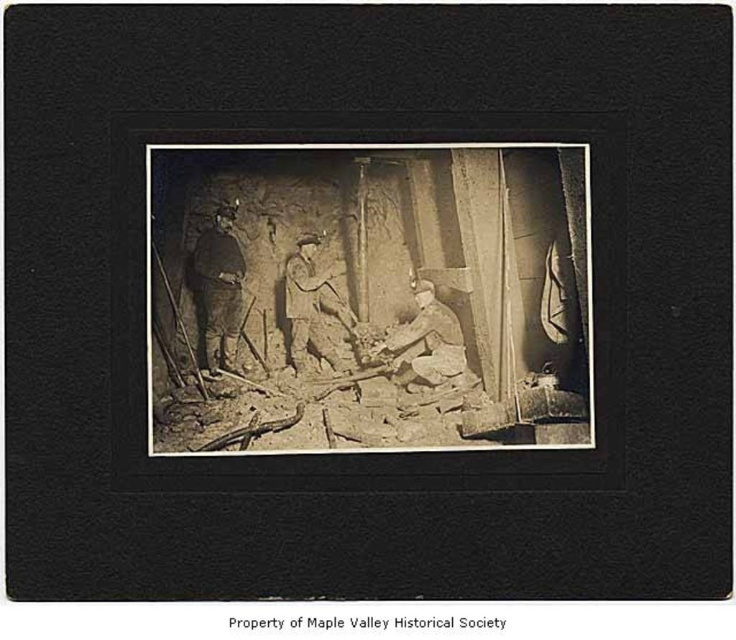
You are a safety inspector in this mining site. You need to ensure that the dark brown leather jacket at center and the light brown leather jacket at lower right can both fit on a storage shelf that is 1.2 meters wide. Based on their widths, will they fit together?

The dark brown leather jacket at center has a lesser width compared to light brown leather jacket at lower right. However, without knowing the exact widths of both jackets, it is impossible to determine if their combined width exceeds 1.2 meters. Additional measurements are required.